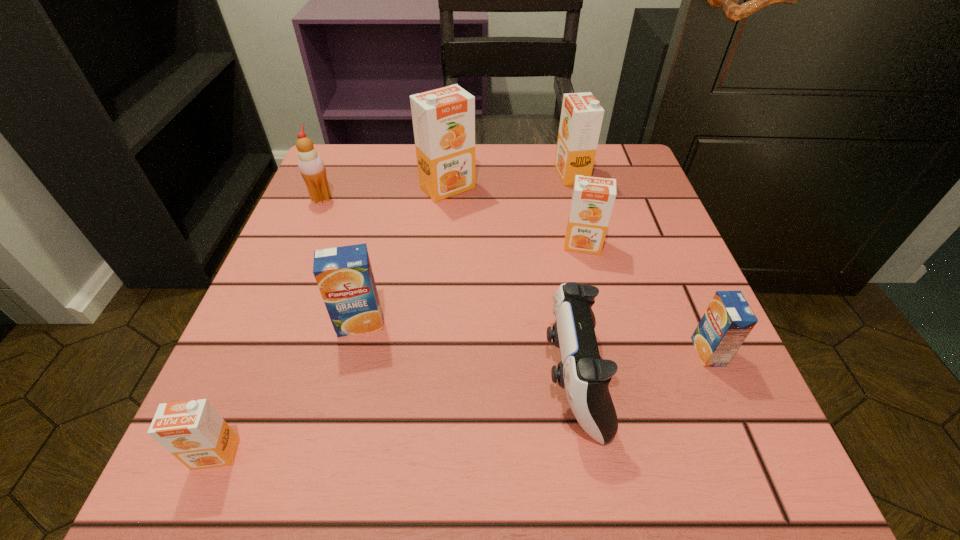
Find the location of a particular element. vacant space in between the left blue orange_juice and the rightmost object is located at coordinates (534, 338).

Find the location of a particular element. The width and height of the screenshot is (960, 540). vacant region between the left blue orange_juice and the leftmost orange orange juice is located at coordinates (288, 388).

Identify the location of vacant space that's between the control and the tallest orange_juice. (511, 284).

This screenshot has width=960, height=540. In order to click on vacant area between the control and the nearest orange orange juice in this screenshot , I will do `click(395, 417)`.

Where is `vacant space that's between the leftmost orange_juice and the second smallest orange orange juice`? vacant space that's between the leftmost orange_juice and the second smallest orange orange juice is located at coordinates click(x=399, y=349).

Locate which object is the seventh closest to the second biggest orange orange juice. Please provide its 2D coordinates. Your answer should be formatted as a tuple, i.e. [(x, y)], where the tuple contains the x and y coordinates of a point satisfying the conditions above.

[(193, 431)]

Point out which object is positioned as the seventh nearest to the tallest object. Please provide its 2D coordinates. Your answer should be formatted as a tuple, i.e. [(x, y)], where the tuple contains the x and y coordinates of a point satisfying the conditions above.

[(193, 431)]

Choose which orange_juice is the fifth nearest neighbor to the second orange orange juice from left to right. Please provide its 2D coordinates. Your answer should be formatted as a tuple, i.e. [(x, y)], where the tuple contains the x and y coordinates of a point satisfying the conditions above.

[(193, 431)]

Locate which orange_juice is the closest to the fifth shortest orange_juice. Please provide its 2D coordinates. Your answer should be formatted as a tuple, i.e. [(x, y)], where the tuple contains the x and y coordinates of a point satisfying the conditions above.

[(593, 198)]

You are a GUI agent. You are given a task and a screenshot of the screen. Output one action in this format:
    pyautogui.click(x=<x>, y=<y>)
    Task: Click on the third closest orange orange juice to the right blue orange_juice
    
    Given the screenshot: What is the action you would take?
    pyautogui.click(x=443, y=119)